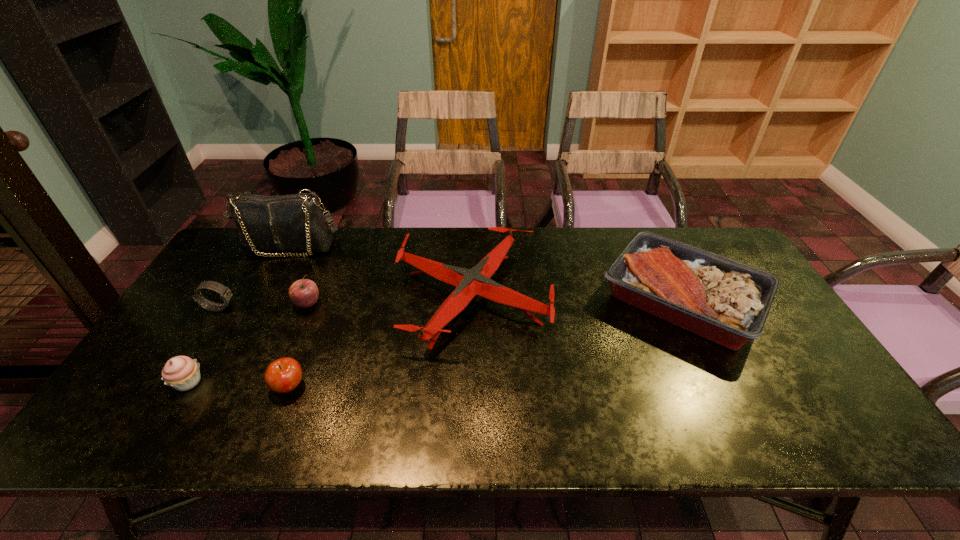
Where is `the tallest object`? The height and width of the screenshot is (540, 960). the tallest object is located at coordinates (294, 222).

Find the location of a particular element. tray is located at coordinates (723, 300).

Locate an element on the screen. This screenshot has width=960, height=540. drone is located at coordinates (476, 281).

The width and height of the screenshot is (960, 540). Identify the location of the farther apple. (304, 293).

Where is `watch`? The image size is (960, 540). watch is located at coordinates (225, 293).

The height and width of the screenshot is (540, 960). Find the location of `cupcake`. cupcake is located at coordinates (181, 372).

Find the location of `the nearer apple`. the nearer apple is located at coordinates (283, 375).

This screenshot has width=960, height=540. Find the location of `free location located 0.070m at the front of the handbag with chain and zipper`. free location located 0.070m at the front of the handbag with chain and zipper is located at coordinates (275, 274).

Find the location of `free location located 0.250m on the left of the rightmost object`. free location located 0.250m on the left of the rightmost object is located at coordinates point(515,300).

Image resolution: width=960 pixels, height=540 pixels. I want to click on vacant space located 0.150m on the front of the sixth object from left to right, so click(470, 409).